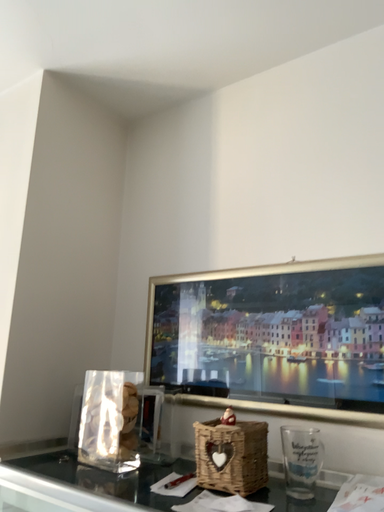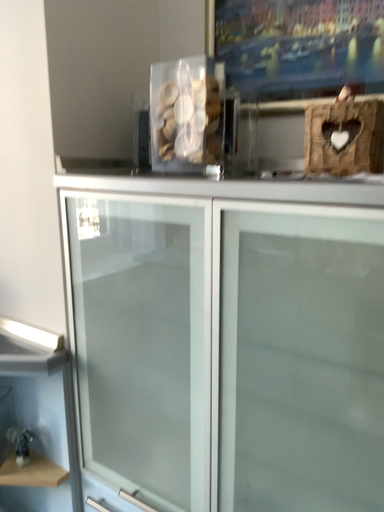
Question: Which way did the camera rotate in the video?

Choices:
 (A) rotated upward
 (B) rotated downward

Answer: (B)